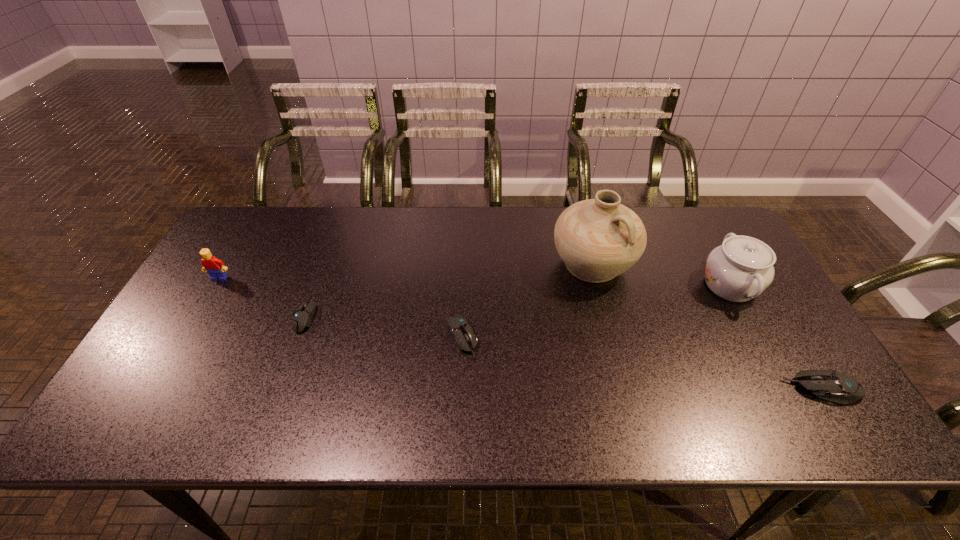
This screenshot has height=540, width=960. What are the coordinates of `location for an additional mouse_(computer_equipment) to make spacing equal` in the screenshot? It's located at (634, 362).